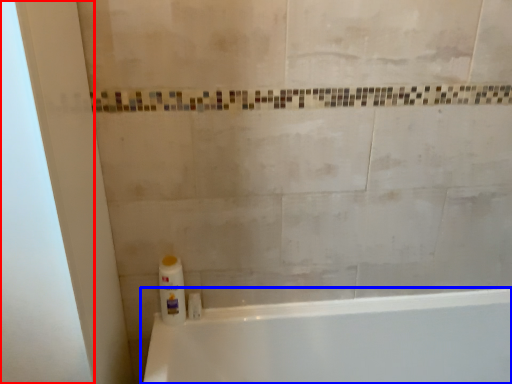
Question: Which of the following is the farthest to the observer, screen door (highlighted by a red box) or bathtub (highlighted by a blue box)?

Choices:
 (A) screen door
 (B) bathtub

Answer: (B)